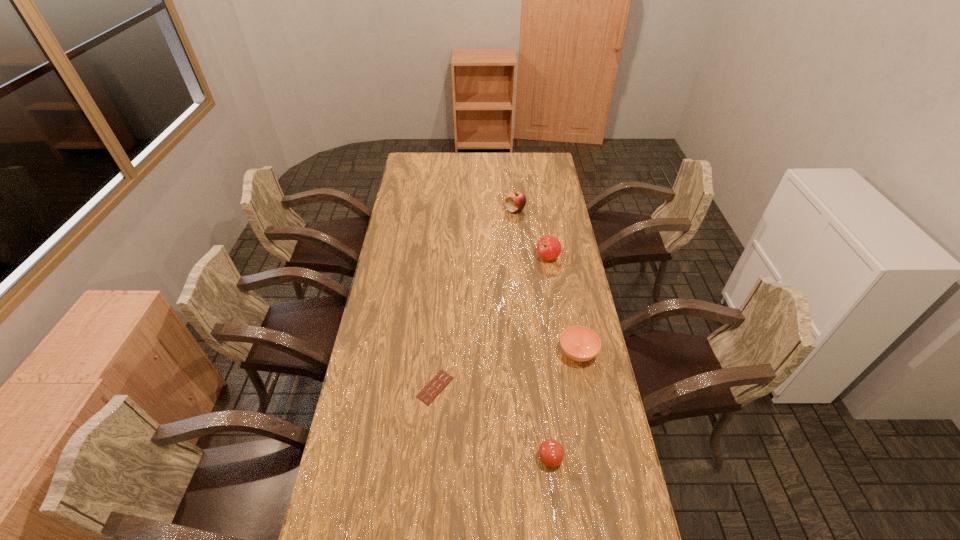
This screenshot has height=540, width=960. What are the coordinates of `empty space between the nearest object and the chocolate bar` in the screenshot? It's located at (492, 423).

Identify the location of free space between the leftmost object and the soup bowl. (506, 370).

The width and height of the screenshot is (960, 540). What are the coordinates of `vacant area between the soup bowl and the second farthest object` in the screenshot? It's located at (563, 305).

Locate an element on the screen. The image size is (960, 540). vacant area between the second nearest apple and the soup bowl is located at coordinates (563, 305).

I want to click on free space between the leftmost object and the soup bowl, so click(506, 370).

At what (x,y) coordinates should I click in order to perform the action: click on empty location between the farthest apple and the shortest object. Please return your answer as a coordinate pair (x, y). The height and width of the screenshot is (540, 960). Looking at the image, I should click on tap(475, 299).

In order to click on object that stands as the closest to the farthest object in this screenshot , I will do `click(548, 247)`.

At what (x,y) coordinates should I click in order to perform the action: click on the third closest object to the farthest apple. Please return your answer as a coordinate pair (x, y). Looking at the image, I should click on (442, 379).

Image resolution: width=960 pixels, height=540 pixels. I want to click on apple identified as the closest to the third shortest object, so click(x=548, y=247).

Image resolution: width=960 pixels, height=540 pixels. I want to click on apple that stands as the closest to the second nearest apple, so (x=515, y=201).